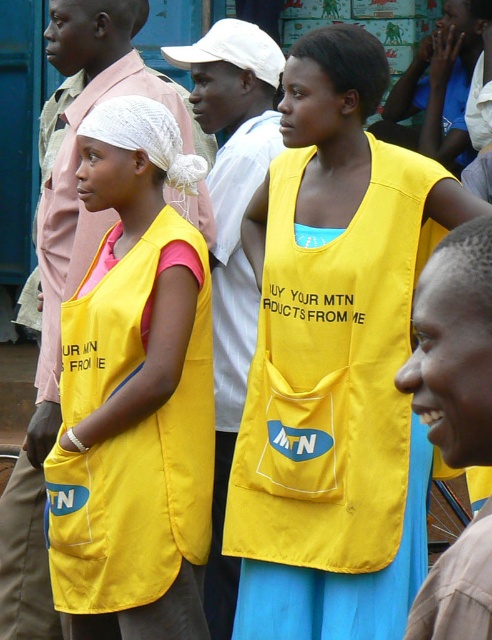
From the picture: You are a photographer who needs to ensure that both vests are visible in the photo. Given that the yellow fabric vest at center is larger than the matte yellow vest at center, which vest should you focus on to capture both vests clearly in the frame?

The yellow fabric vest at center is bigger than the matte yellow vest at center, so focusing on the larger yellow fabric vest at center will help ensure both vests are visible in the frame.